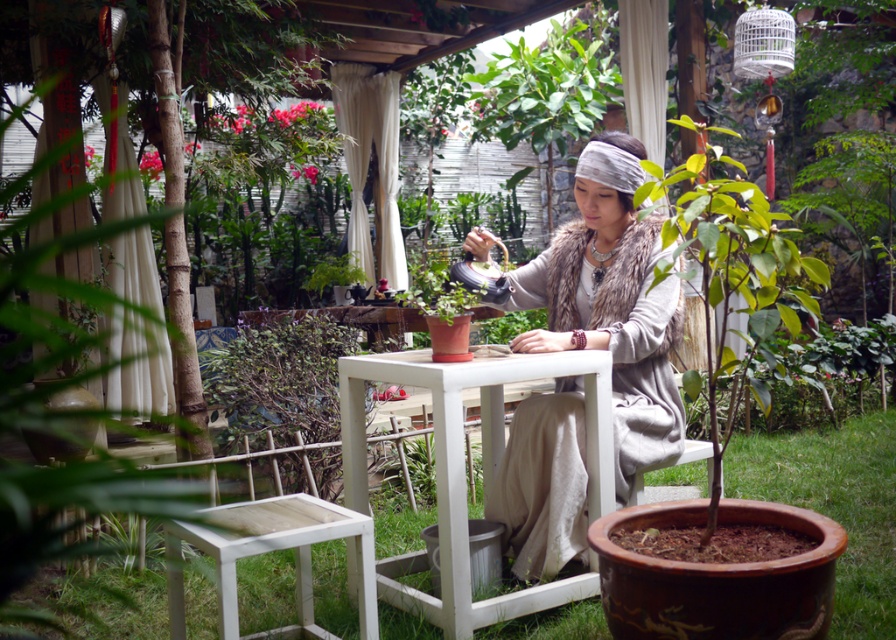
Question: Which point appears farthest from the camera in this image?

Choices:
 (A) (549, 404)
 (B) (271, 547)
 (C) (308, 387)
 (D) (591, 465)

Answer: (C)

Question: Which is nearer to the white wood stool at lower left?

Choices:
 (A) white wooden table at center
 (B) green leafy plant at lower left

Answer: (A)

Question: Does green leafy plant at lower left appear under white wood stool at lower left?

Choices:
 (A) no
 (B) yes

Answer: (A)

Question: Is fur vest at center closer to the viewer compared to white wooden table at center?

Choices:
 (A) yes
 (B) no

Answer: (A)

Question: Based on their relative distances, which object is farther from the white wood stool at lower left?

Choices:
 (A) white wooden table at center
 (B) green leafy plant at lower left

Answer: (B)

Question: Is white wooden table at center to the left of white wood stool at lower left from the viewer's perspective?

Choices:
 (A) no
 (B) yes

Answer: (A)